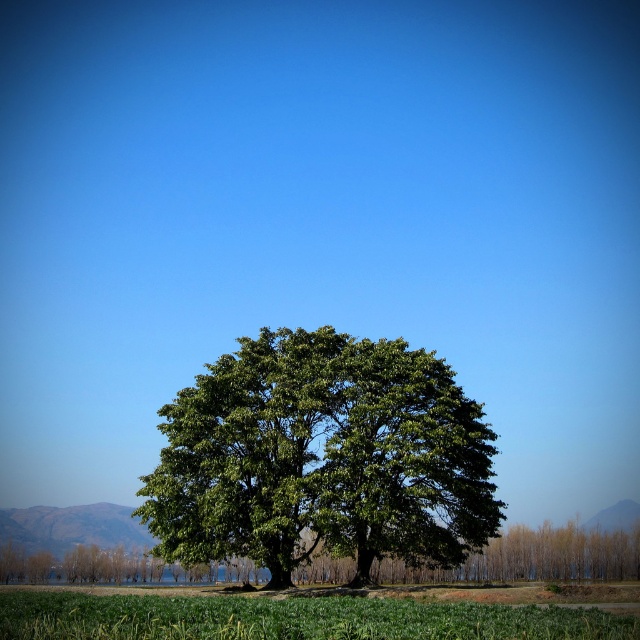
Question: Is green leafy tree at center smaller than green grass at lower center?

Choices:
 (A) yes
 (B) no

Answer: (A)

Question: Can you confirm if green leafy tree at center is positioned to the left of green grass at lower center?

Choices:
 (A) no
 (B) yes

Answer: (A)

Question: Among these points, which one is farthest from the camera?

Choices:
 (A) (566, 630)
 (B) (456, 481)

Answer: (B)

Question: Which object is farther from the camera taking this photo?

Choices:
 (A) green grass at lower center
 (B) green leafy tree at center

Answer: (B)

Question: Which point appears closest to the camera in this image?

Choices:
 (A) (326, 492)
 (B) (221, 616)

Answer: (B)

Question: Is green leafy tree at center bigger than green grass at lower center?

Choices:
 (A) yes
 (B) no

Answer: (B)